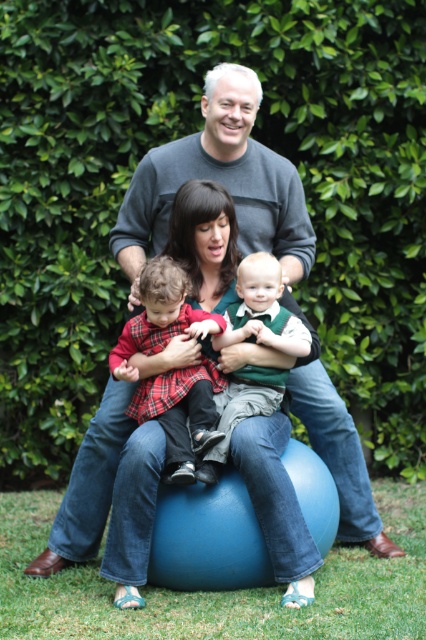
You are standing in front of the family photo and want to know which of the two points, point 1 at coordinates point (x=224, y=387) or point 2 at coordinates point (x=273, y=371), is closer to you. Which one is closer?

Point 1 at coordinates point (x=224, y=387) is closer to you because it is further to the viewer than point 2 at coordinates point (x=273, y=371).

What is the position of the plaid fabric shirt at center in the image?

The plaid fabric shirt at center is located at point 0.647 on the x axis and 0.427 on the y axis.